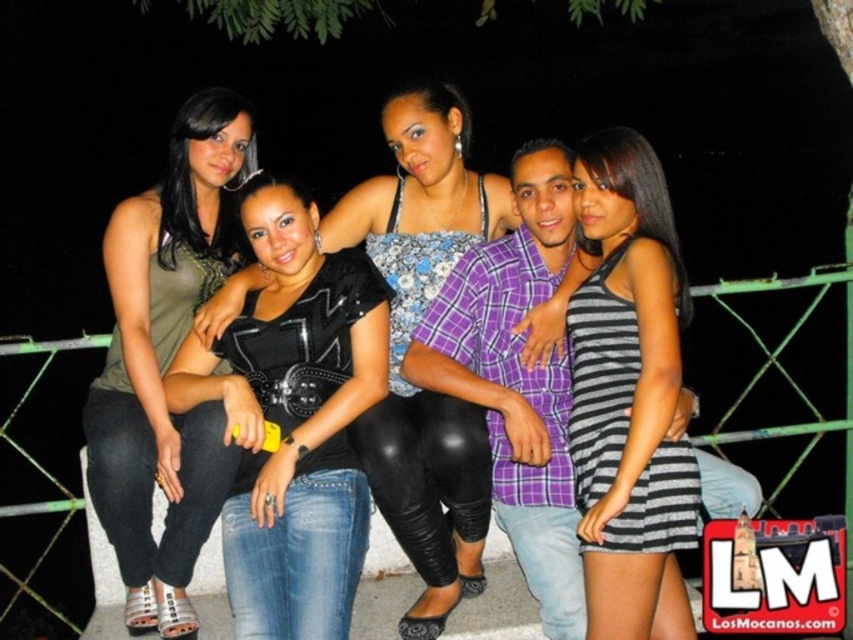
Can you confirm if black leather top at center is positioned below striped fabric dress at center?

Yes, black leather top at center is below striped fabric dress at center.

Who is more distant from viewer, (x=335, y=337) or (x=613, y=620)?

Positioned behind is point (x=335, y=337).

You are a GUI agent. You are given a task and a screenshot of the screen. Output one action in this format:
    pyautogui.click(x=<x>, y=<y>)
    Task: Click on the black leather top at center
    
    Given the screenshot: What is the action you would take?
    pyautogui.click(x=293, y=419)

You are a GUI agent. You are given a task and a screenshot of the screen. Output one action in this format:
    pyautogui.click(x=<x>, y=<y>)
    Task: Click on the black leather top at center
    Image resolution: width=853 pixels, height=640 pixels.
    Given the screenshot: What is the action you would take?
    pyautogui.click(x=293, y=419)

Does black leather top at center have a greater height compared to striped fabric dress at right?

In fact, black leather top at center may be shorter than striped fabric dress at right.

Can you confirm if black leather top at center is wider than striped fabric dress at right?

Yes, black leather top at center is wider than striped fabric dress at right.

Is point (273, 502) closer to camera compared to point (627, 168)?

No, it is behind (627, 168).

Locate an element on the screen. Image resolution: width=853 pixels, height=640 pixels. black leather top at center is located at coordinates (293, 419).

Which is in front, point (531, 285) or point (393, 428)?

Point (393, 428) is more forward.

Based on the photo, measure the distance between striped fabric dress at center and camera.

3.06 meters

You are a GUI agent. You are given a task and a screenshot of the screen. Output one action in this format:
    pyautogui.click(x=<x>, y=<y>)
    Task: Click on the striped fabric dress at center
    The image size is (853, 640).
    Given the screenshot: What is the action you would take?
    pyautogui.click(x=517, y=316)

In order to click on striped fabric dress at center in this screenshot , I will do `click(517, 316)`.